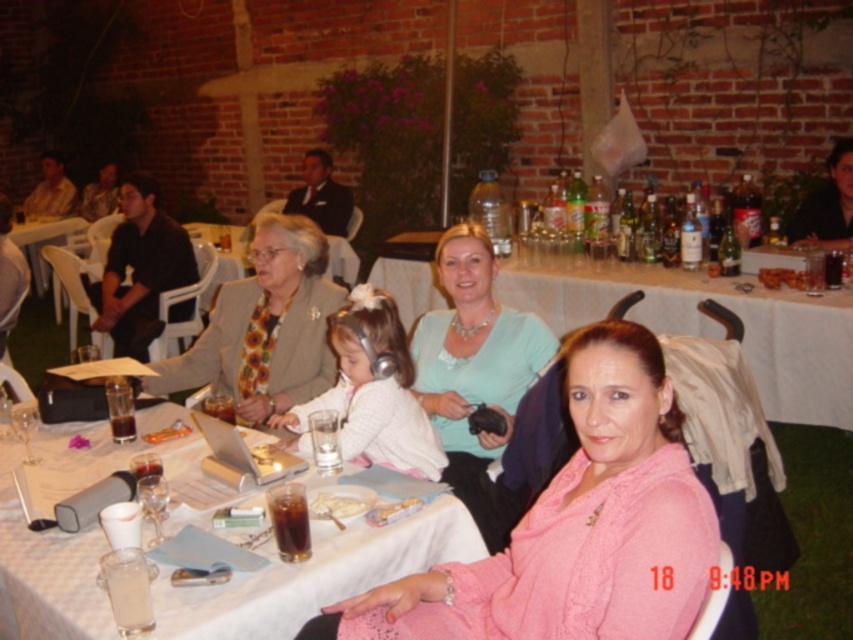
You are a caterer setting up for the event and need to place a large centerpiece on the table. Which table should you choose between the white tablecloth at center and the white plastic table at lower left?

The white tablecloth at center has a greater width than the white plastic table at lower left, so you should choose the white tablecloth at center to place the large centerpiece.

Based on the photo, you are standing at the entrance of the reception area and see the brown crumbly bread at upper center on the table. If you want to reach it without moving any chairs, can you estimate whether you can comfortably grab it from your current position?

The brown crumbly bread at upper center is 3.36 meters away from the viewer. Since this distance is quite far, it might be difficult to comfortably reach it without moving closer or using assistance.